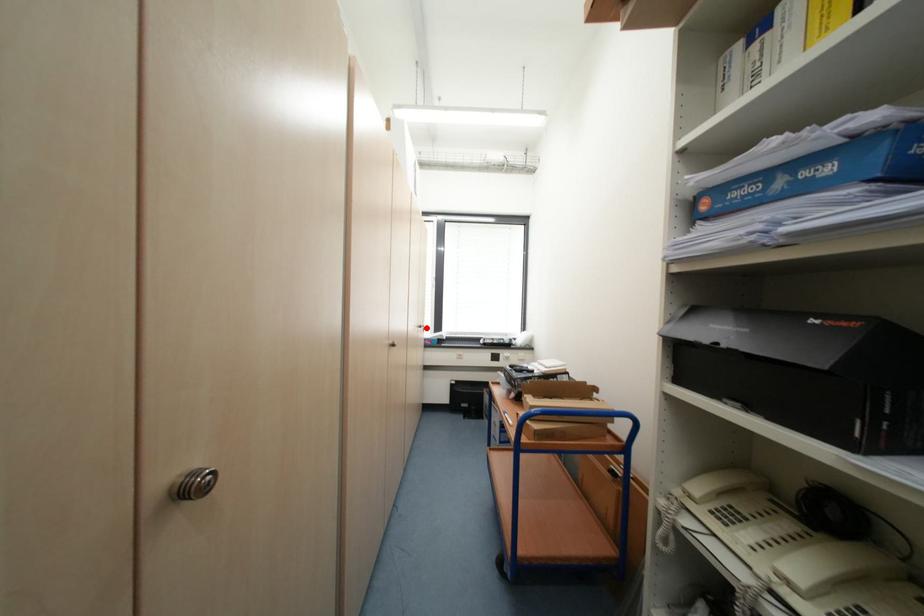
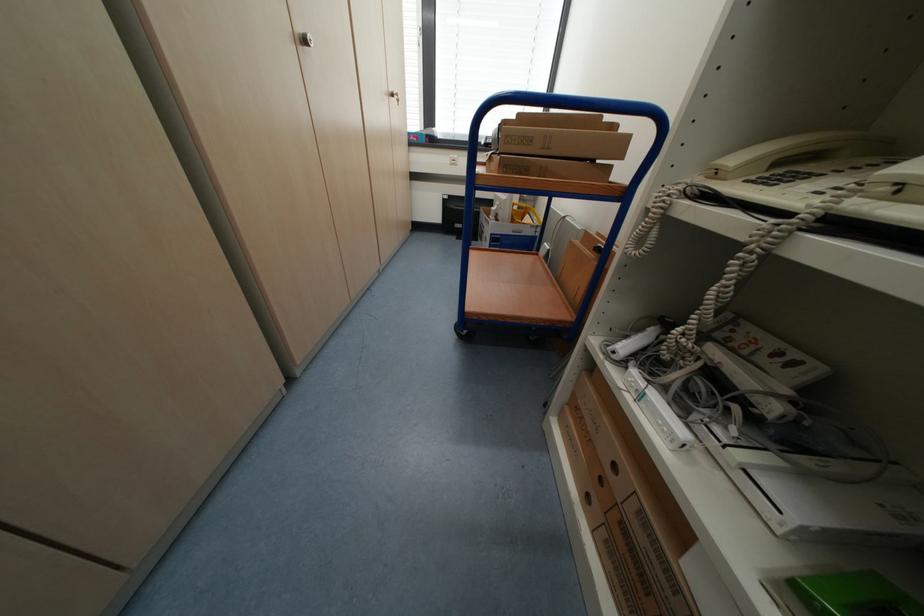
Question: I am providing you with two images of the same scene from different viewpoints. In image1, a red point is highlighted. Considering the same 3D point in image2, which of the following is correct?

Choices:
 (A) It is closer
 (B) It is farther

Answer: (A)